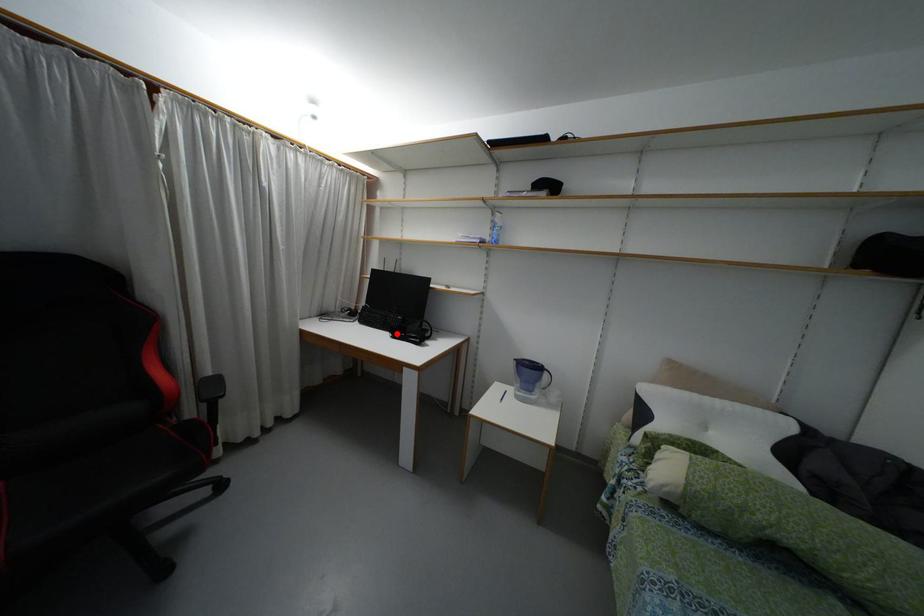
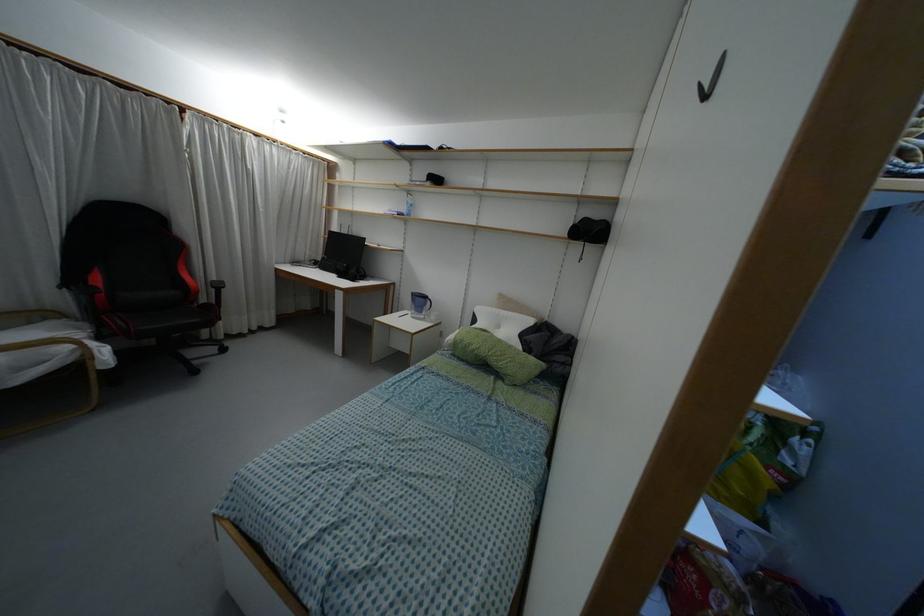
Question: I am providing you with two images of the same scene from different viewpoints. A red point is shown in image1. For the corresponding object point in image2, is it positioned nearer or farther from the camera?

Choices:
 (A) Nearer
 (B) Farther

Answer: (A)